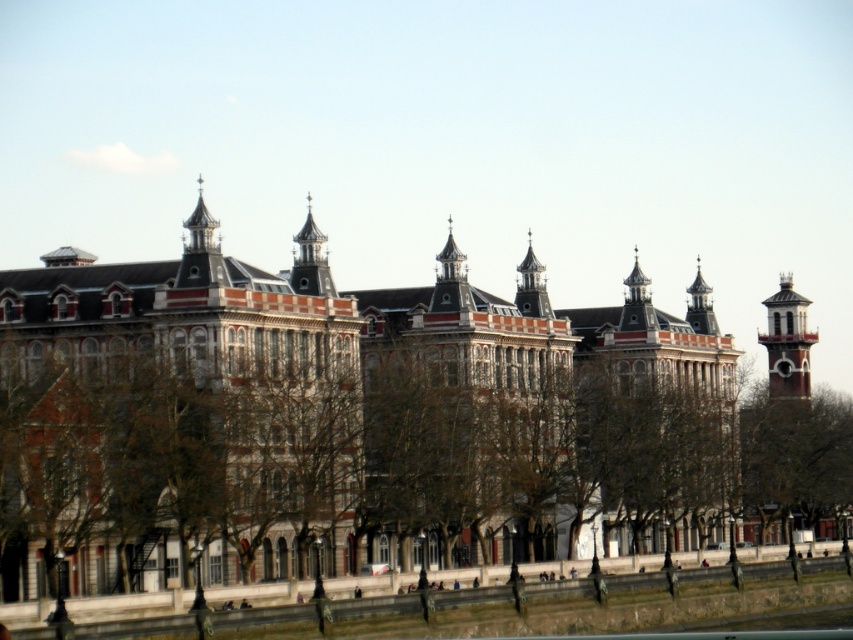
Question: Can you confirm if brown leafless tree at center is smaller than smooth gray steeple at center?

Choices:
 (A) yes
 (B) no

Answer: (B)

Question: Is smooth gray steeple at center smaller than polished brass clock tower at upper right?

Choices:
 (A) no
 (B) yes

Answer: (A)

Question: Can you confirm if red brick clock tower at right is positioned to the left of polished brass clock tower at upper right?

Choices:
 (A) yes
 (B) no

Answer: (B)

Question: Which of these objects is positioned farthest from the polished brass clock tower at upper right?

Choices:
 (A) smooth gray steeple at center
 (B) red brick clock tower at right

Answer: (A)

Question: Among these objects, which one is farthest from the camera?

Choices:
 (A) polished brass clock tower at upper right
 (B) smooth gray steeple at center

Answer: (A)

Question: Which object is positioned farthest from the polished brass clock tower at upper right?

Choices:
 (A) gray stone tower at center
 (B) red brick clock tower at right

Answer: (A)